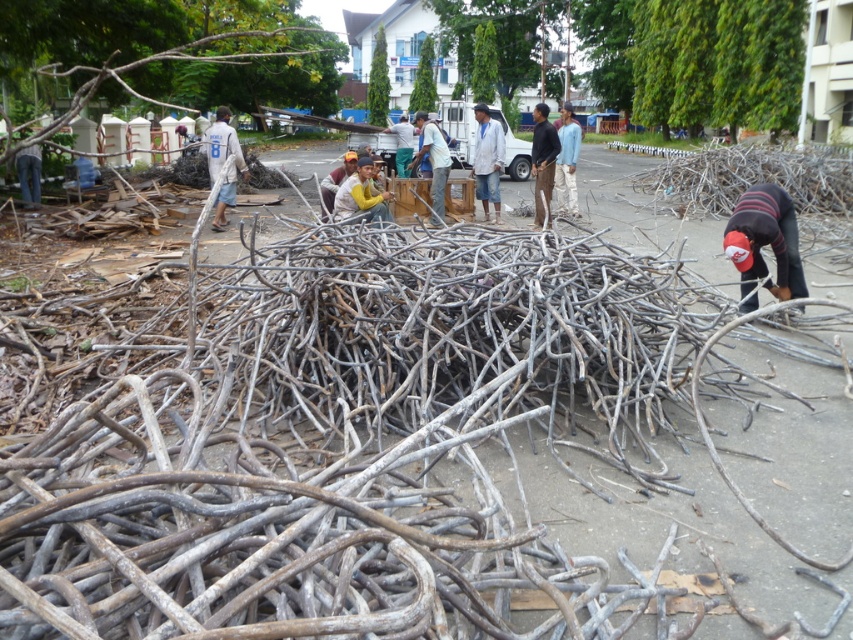
Question: Which of the following is the farthest from the observer?

Choices:
 (A) light blue fabric shirt at center
 (B) white fabric shirt at center
 (C) striped knit cap at lower right
 (D) yellow shirt at center

Answer: (A)

Question: Which of the following is the farthest from the observer?

Choices:
 (A) light blue fabric shirt at center
 (B) white fabric shirt at center

Answer: (A)

Question: Can you confirm if white fabric shirt at center is thinner than yellow shirt at center?

Choices:
 (A) no
 (B) yes

Answer: (A)

Question: Which object is the farthest from the white fabric shirt at center?

Choices:
 (A) yellow shirt at center
 (B) gray wood tree branch at upper left
 (C) light blue fabric shirt at center

Answer: (B)

Question: Is striped knit cap at lower right thinner than white fabric shirt at center?

Choices:
 (A) yes
 (B) no

Answer: (A)

Question: Is white fabric shirt at center closer to camera compared to light blue fabric shirt at center?

Choices:
 (A) no
 (B) yes

Answer: (B)